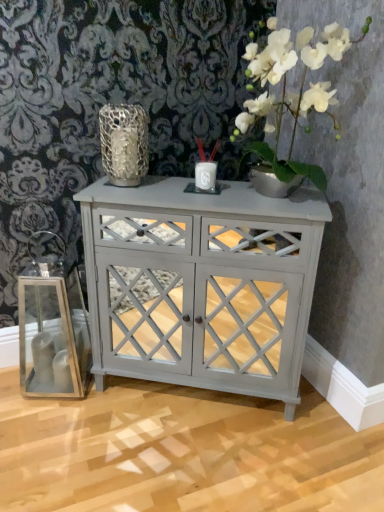
What do you see at coordinates (201, 284) in the screenshot? I see `gray painted wood cabinet at center` at bounding box center [201, 284].

Find the location of a particular element. gray painted wood cabinet at center is located at coordinates (201, 284).

This screenshot has width=384, height=512. Identify the location of gray painted wood cabinet at center. (201, 284).